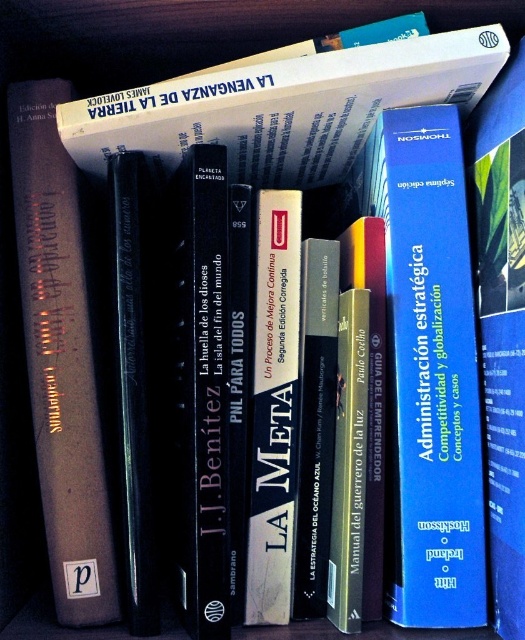
Question: Is blue hardcover book at center above matte gray book at left?

Choices:
 (A) yes
 (B) no

Answer: (B)

Question: Is blue hardcover book at center further to camera compared to matte gray book at left?

Choices:
 (A) no
 (B) yes

Answer: (B)

Question: Which point is closer to the camera?

Choices:
 (A) matte gray book at left
 (B) blue hardcover book at center

Answer: (A)

Question: Among these points, which one is farthest from the camera?

Choices:
 (A) (68, 253)
 (B) (378, 176)

Answer: (B)

Question: Which of the following is the farthest from the observer?

Choices:
 (A) matte gray book at left
 (B) blue hardcover book at center

Answer: (B)

Question: In this image, where is blue hardcover book at center located relative to matte gray book at left?

Choices:
 (A) right
 (B) left

Answer: (A)